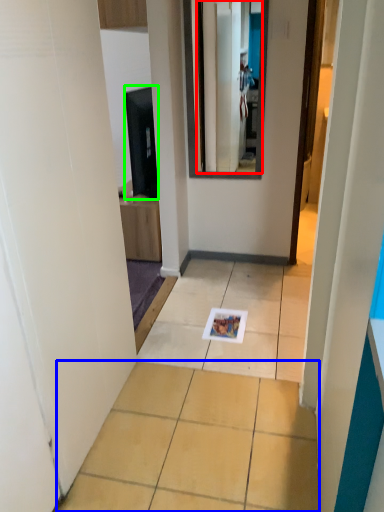
Question: Based on their relative distances, which object is nearer to mirror (highlighted by a red box)? Choose from ceramic tile (highlighted by a blue box) and appliance (highlighted by a green box).

Choices:
 (A) ceramic tile
 (B) appliance

Answer: (B)